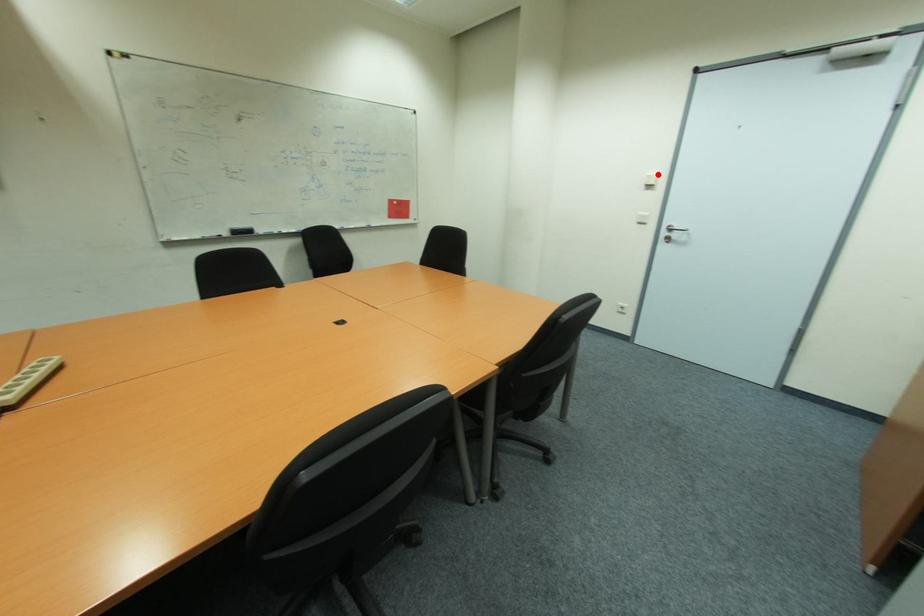
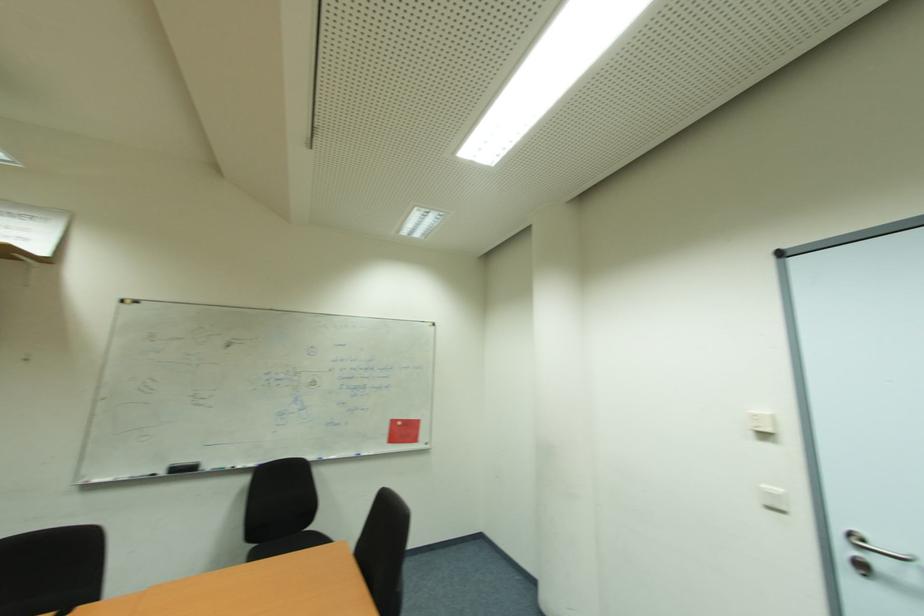
Locate, in the second image, the point that corresponds to the highlighted location in the first image.

(771, 414)